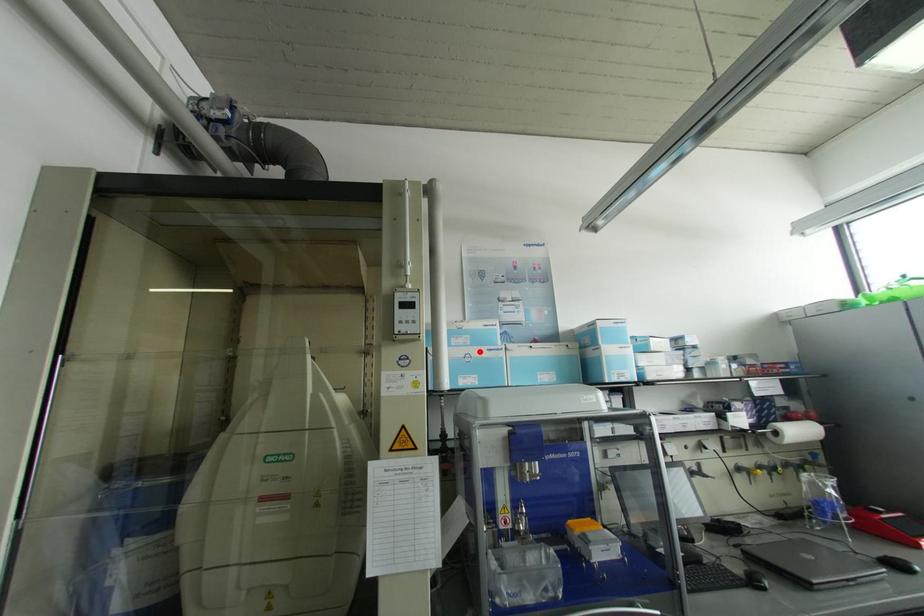
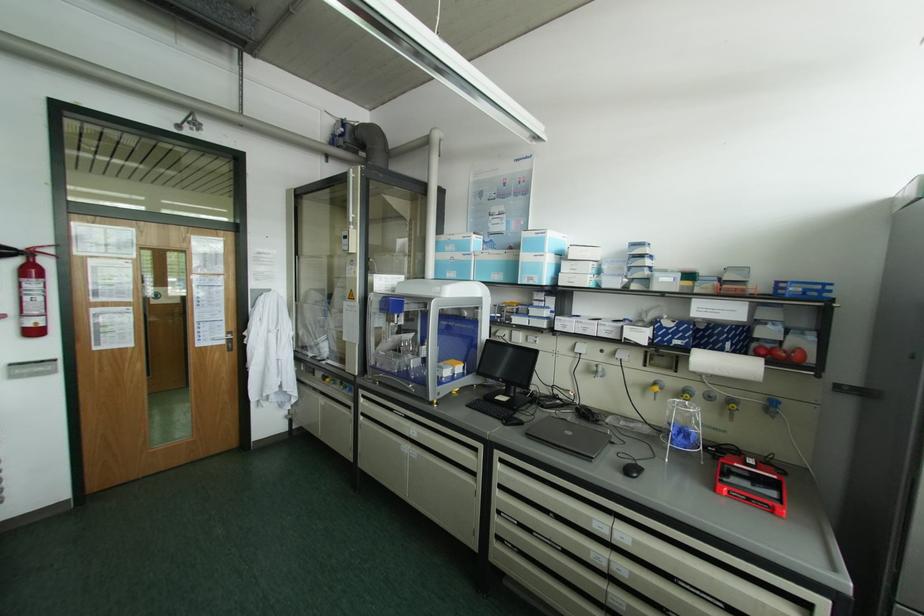
Locate, in the second image, the point that corresponds to the highlighted location in the first image.

(457, 256)